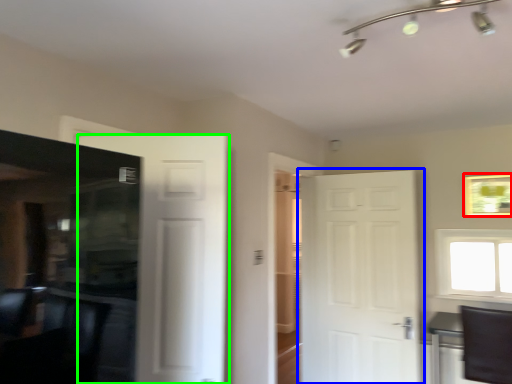
Question: Which is nearer to the picture frame (highlighted by a red box)? door (highlighted by a blue box) or door (highlighted by a green box).

Choices:
 (A) door
 (B) door

Answer: (A)